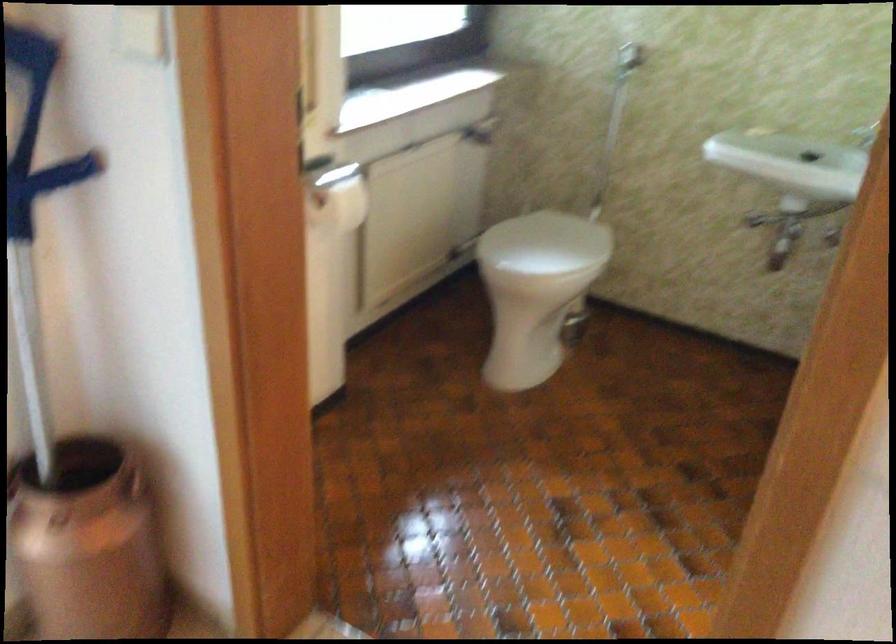
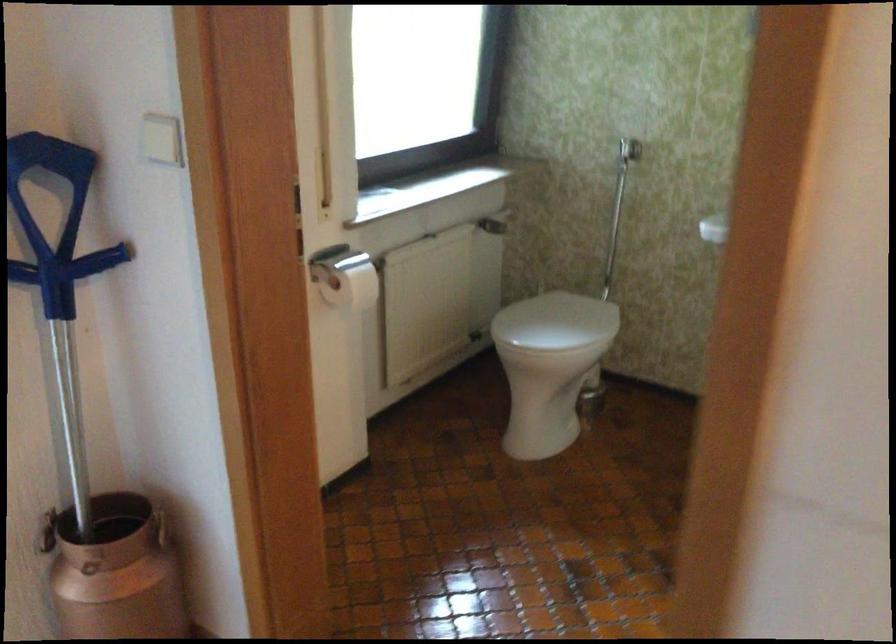
Question: Based on the continuous images, in which direction is the camera rotating? Reply with the corresponding letter.

Choices:
 (A) Left
 (B) Right
 (C) Up
 (D) Down

Answer: (C)